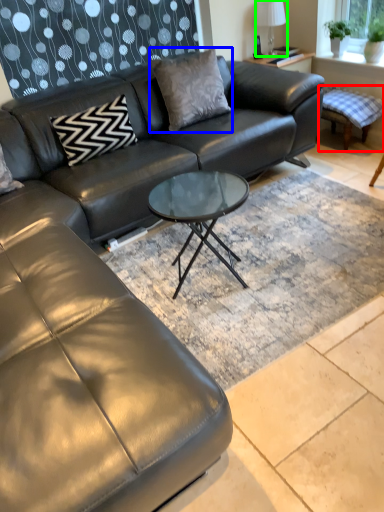
Question: Based on their relative distances, which object is nearer to swivel chair (highlighted by a red box)? Choose from pillow (highlighted by a blue box) and lamp (highlighted by a green box).

Choices:
 (A) pillow
 (B) lamp

Answer: (B)